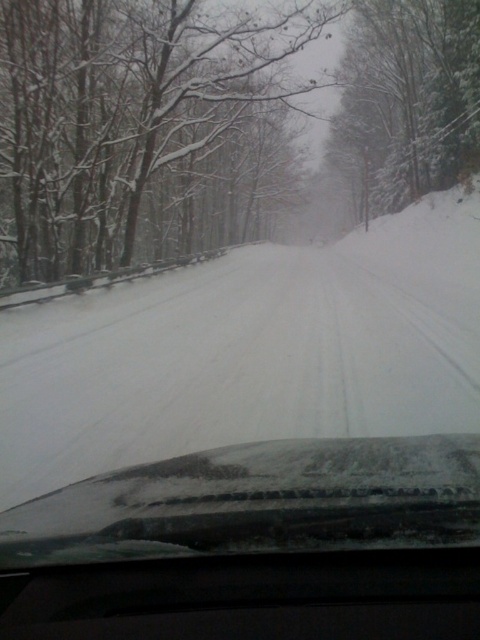
Question: Does snowy bark tree at center have a larger size compared to snowy glass windshield at center?

Choices:
 (A) yes
 (B) no

Answer: (A)

Question: Which point appears farthest from the camera in this image?

Choices:
 (A) (175, 49)
 (B) (359, 438)

Answer: (A)

Question: In this image, where is snowy bark tree at center located relative to snowy glass windshield at center?

Choices:
 (A) below
 (B) above

Answer: (B)

Question: Can you confirm if snowy bark tree at center is wider than snowy glass windshield at center?

Choices:
 (A) no
 (B) yes

Answer: (B)